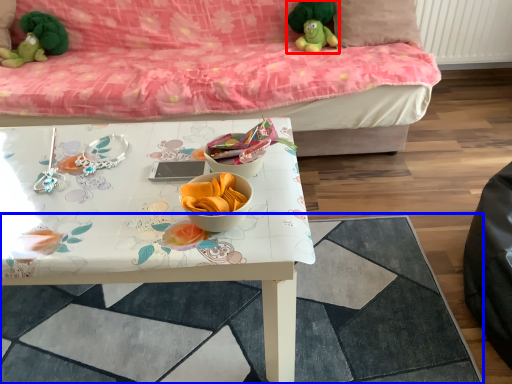
Question: Which point is closer to the camera, toy (highlighted by a red box) or tile (highlighted by a blue box)?

Choices:
 (A) toy
 (B) tile

Answer: (B)